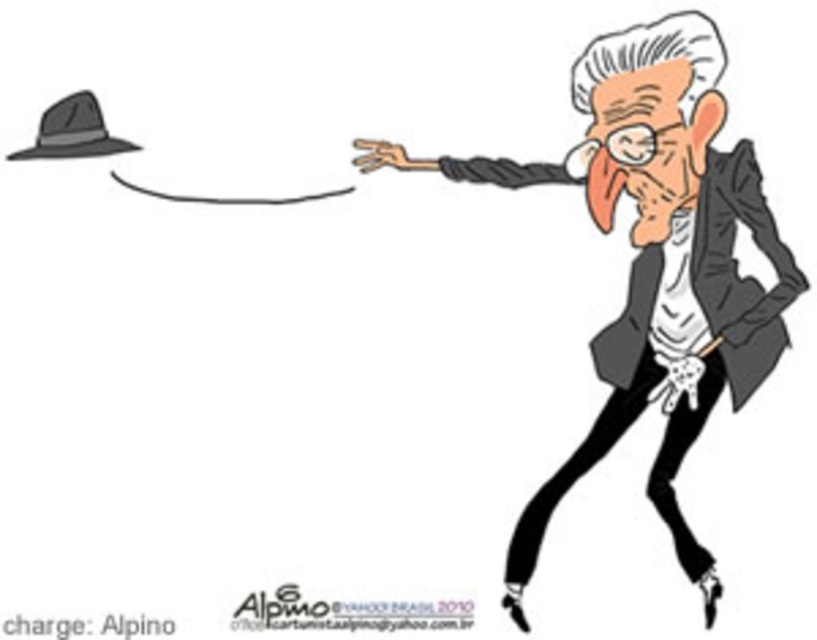
Is gray matte hat at upper left bigger than matte black business suit at right?

Indeed, gray matte hat at upper left has a larger size compared to matte black business suit at right.

Can you confirm if gray matte hat at upper left is thinner than matte black business suit at right?

No, gray matte hat at upper left is not thinner than matte black business suit at right.

Does point (672, 189) come closer to viewer compared to point (746, 188)?

That is False.

Locate an element on the screen. gray matte hat at upper left is located at coordinates (654, 262).

Which of these two, gray matte hat at upper left or dark gray felt hat at upper left, stands shorter?

dark gray felt hat at upper left is shorter.

Who is lower down, gray matte hat at upper left or dark gray felt hat at upper left?

gray matte hat at upper left

Is point (688, 320) positioned behind point (101, 144)?

No, it is not.

The height and width of the screenshot is (640, 817). Identify the location of gray matte hat at upper left. (654, 262).

Based on the photo, which is more to the right, matte black business suit at right or dark gray felt hat at upper left?

matte black business suit at right is more to the right.

Does point (681, 436) lie in front of point (57, 113)?

Yes, point (681, 436) is closer to viewer.

Is point (635, 314) in front of point (28, 154)?

Yes, it is in front of point (28, 154).

This screenshot has width=817, height=640. Find the location of `matte black business suit at right`. matte black business suit at right is located at coordinates (725, 321).